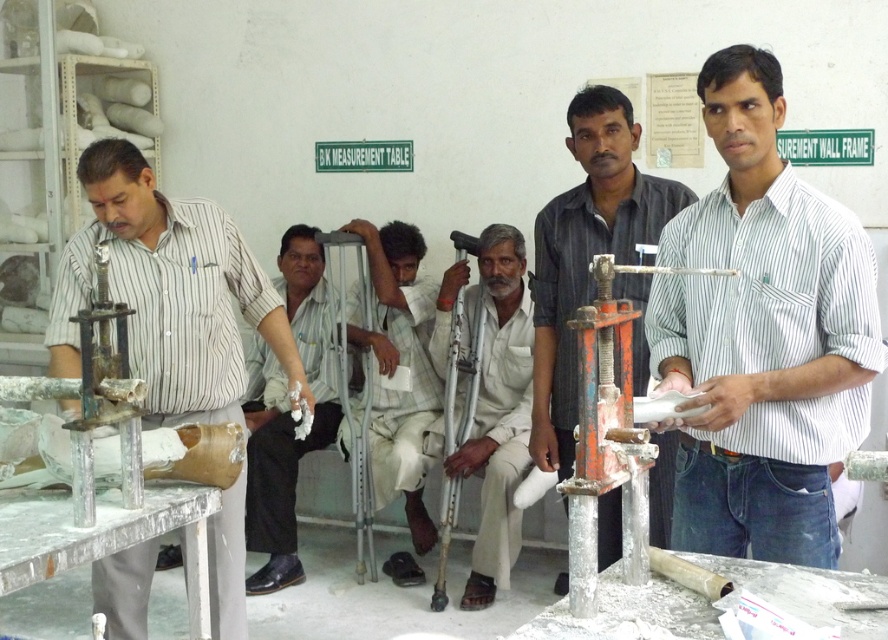
Which object from the list is located at the coordinates point (169,292)?

The matte striped shirt at left is located at point (169,292).

Consider the image. You are an observer in the workshop. You notice the white striped shirt at center and the white fabric crutches at center. Which object is located above the other?

The white striped shirt at center is positioned over white fabric crutches at center, so the shirt is above the crutches.

You are standing in the workshop and want to determine which of the two points, point (147,362) or point (425,348), is nearer to you. Based on the scene description, which point is closer?

Point (147,362) is closer to the viewer than point (425,348).